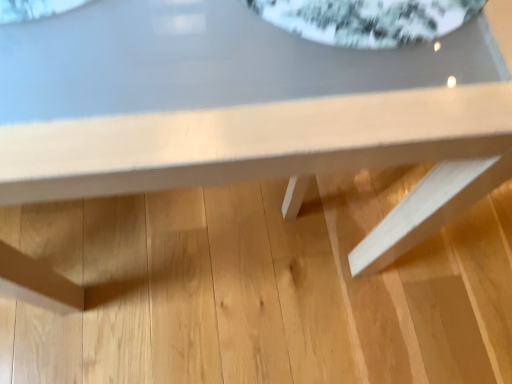
At what (x,y) coordinates should I click in order to perform the action: click on vacant area that is in front of translucent glass bowl at upper center. Please return your answer as a coordinate pair (x, y). The height and width of the screenshot is (384, 512). Looking at the image, I should click on (285, 106).